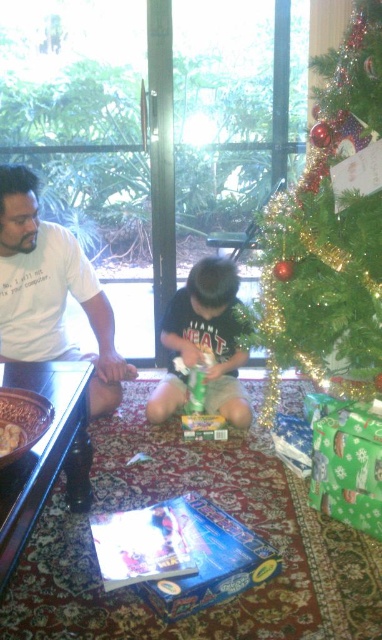
Does green shiny christmas tree at upper right appear under green shiny tree at right?

Incorrect, green shiny christmas tree at upper right is not positioned below green shiny tree at right.

Based on the photo, is green shiny christmas tree at upper right closer to camera compared to green shiny tree at right?

No, it is not.

Locate an element on the screen. Image resolution: width=382 pixels, height=640 pixels. green shiny christmas tree at upper right is located at coordinates (229, 108).

Where is `green shiny christmas tree at upper right`? The height and width of the screenshot is (640, 382). green shiny christmas tree at upper right is located at coordinates (229, 108).

Does green shiny christmas tree at upper right appear under dark green jersey at center?

No.

Who is more distant from viewer, (42, 179) or (208, 296)?

Point (42, 179)

Locate an element on the screen. green shiny christmas tree at upper right is located at coordinates (229, 108).

Which is below, green shiny christmas tree at upper right or white t-shirt at left?

white t-shirt at left is lower down.

Does point (121, 84) come in front of point (9, 172)?

That is False.

The height and width of the screenshot is (640, 382). What are the coordinates of `green shiny christmas tree at upper right` in the screenshot? It's located at (229, 108).